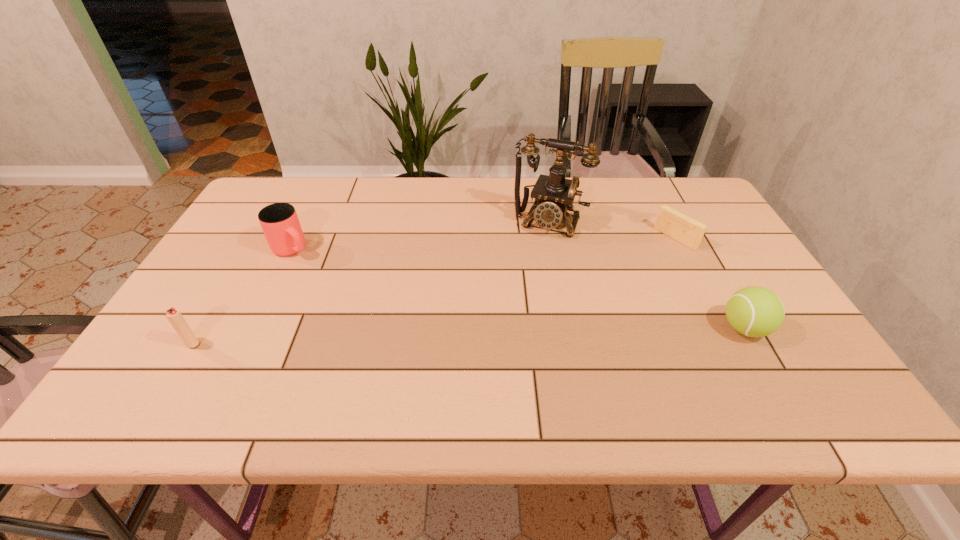
Locate an element on the screen. This screenshot has height=540, width=960. free space located on the handle side of the fourth object from right to left is located at coordinates (348, 292).

Locate an element on the screen. This screenshot has width=960, height=540. free region located on the rotary dial of the tallest object is located at coordinates (514, 298).

Locate an element on the screen. The height and width of the screenshot is (540, 960). vacant space situated on the rotary dial of the tallest object is located at coordinates (521, 280).

This screenshot has width=960, height=540. In order to click on vacant region located on the rotary dial of the tallest object in this screenshot , I will do `click(527, 268)`.

I want to click on free spot located 0.160m at the front of the videotape with spools, so click(631, 269).

Locate an element on the screen. The height and width of the screenshot is (540, 960). vacant point located at the front of the videotape with spools is located at coordinates (568, 312).

You are a GUI agent. You are given a task and a screenshot of the screen. Output one action in this format:
    pyautogui.click(x=<x>, y=<y>)
    Task: Click on the vacant area located at the front of the videotape with spools
    The image size is (960, 540).
    Given the screenshot: What is the action you would take?
    pyautogui.click(x=642, y=262)

Identify the location of object located in the far edge section of the desktop. This screenshot has width=960, height=540. (554, 195).

The width and height of the screenshot is (960, 540). I want to click on igniter present at the near edge, so pyautogui.click(x=174, y=316).

This screenshot has height=540, width=960. I want to click on tennis ball that is at the near edge, so [752, 311].